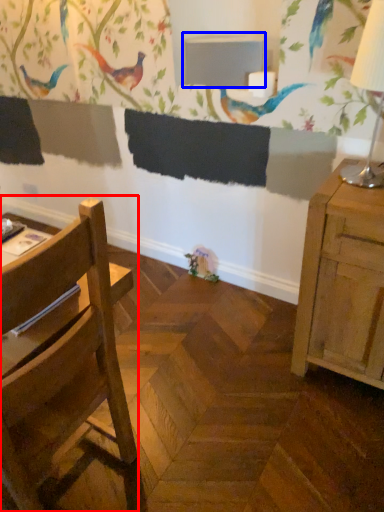
Question: Among these objects, which one is nearest to the camera, chair (highlighted by a red box) or table (highlighted by a blue box)?

Choices:
 (A) chair
 (B) table

Answer: (A)